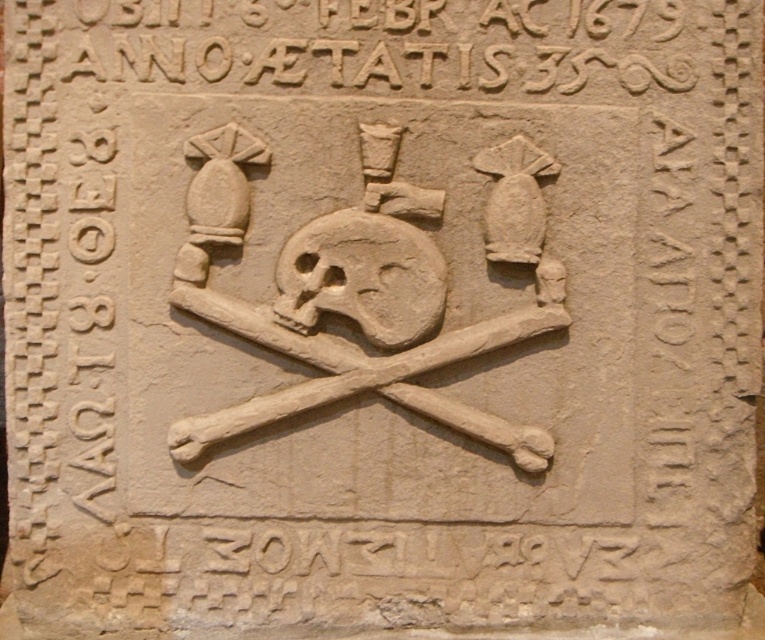
Question: Considering the relative positions of carved stone bones at center and beige stone skull at center in the image provided, where is carved stone bones at center located with respect to beige stone skull at center?

Choices:
 (A) above
 (B) below

Answer: (B)

Question: Is carved stone bones at center thinner than beige stone skull at center?

Choices:
 (A) no
 (B) yes

Answer: (A)

Question: Does carved stone bones at center appear over beige stone skull at center?

Choices:
 (A) no
 (B) yes

Answer: (A)

Question: Which object is closer to the camera taking this photo?

Choices:
 (A) carved stone bones at center
 (B) beige stone skull at center

Answer: (B)

Question: Which point is farther from the camera taking this photo?

Choices:
 (A) (360, 264)
 (B) (490, 336)

Answer: (B)